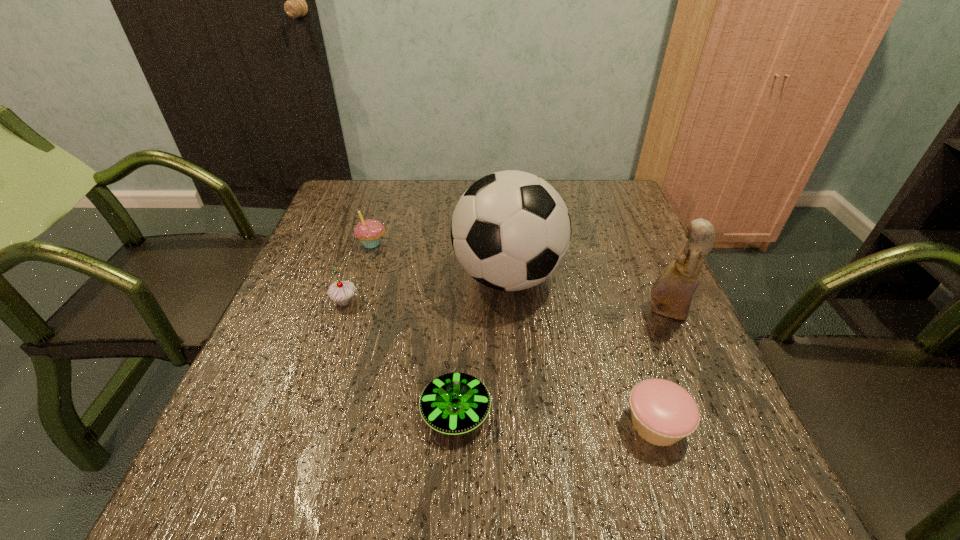
What are the coordinates of `vacant region located on the front-facing side of the rightmost object` in the screenshot? It's located at (532, 312).

Find the location of `free space located on the front-facing side of the rightmost object`. free space located on the front-facing side of the rightmost object is located at coordinates (577, 312).

Identify the location of vacant space located on the back of the farthest cupcake. pyautogui.click(x=387, y=195).

The height and width of the screenshot is (540, 960). I want to click on vacant region located on the right of the third shortest object, so click(x=380, y=302).

Identify the location of vacant area situated on the left of the rightmost cupcake. (515, 424).

Locate an element on the screen. The width and height of the screenshot is (960, 540). vacant space located on the left of the saucer is located at coordinates (321, 412).

Locate an element on the screen. figurine that is at the right edge is located at coordinates (672, 292).

This screenshot has height=540, width=960. Identify the location of cupcake that is at the right edge. (662, 412).

Where is `vacant region at the far edge of the desktop`? The image size is (960, 540). vacant region at the far edge of the desktop is located at coordinates (469, 185).

This screenshot has height=540, width=960. In order to click on vacant space at the left edge of the desktop in this screenshot , I will do `click(221, 462)`.